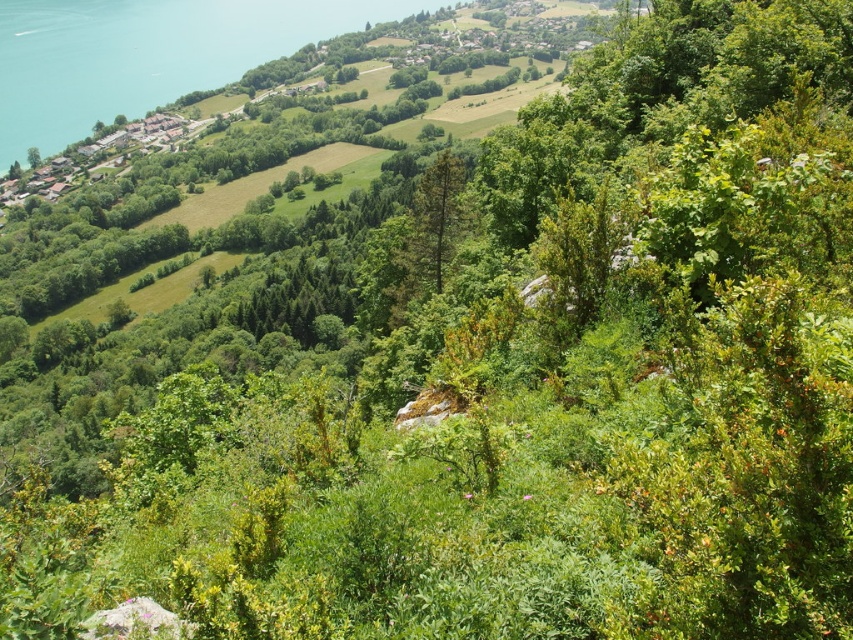
Question: From the image, what is the correct spatial relationship of green water at left in relation to green matte tree at center?

Choices:
 (A) right
 (B) left

Answer: (B)

Question: Observing the image, what is the correct spatial positioning of green water at left in reference to green matte tree at center?

Choices:
 (A) left
 (B) right

Answer: (A)

Question: Where is green water at left located in relation to green matte tree at center in the image?

Choices:
 (A) below
 (B) above

Answer: (B)

Question: Which of the following is the closest to the observer?

Choices:
 (A) (447, 196)
 (B) (94, 19)

Answer: (A)

Question: Which of the following is the closest to the observer?

Choices:
 (A) (x=422, y=177)
 (B) (x=158, y=68)

Answer: (A)